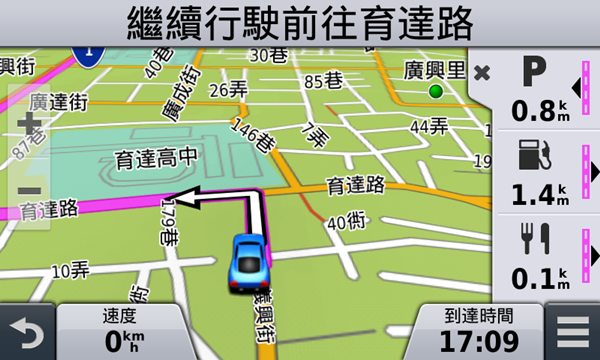
Locate an element on the screen. The height and width of the screenshot is (360, 600). fork is located at coordinates (530, 236).